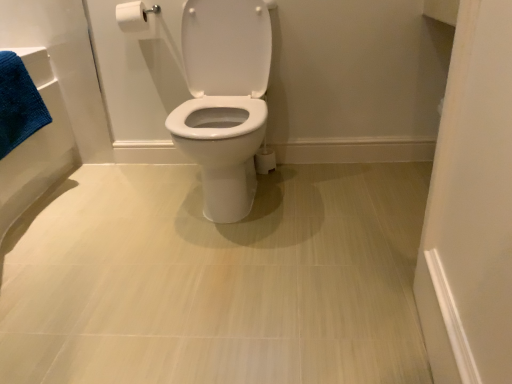
Find the location of a particular element. The width and height of the screenshot is (512, 384). white glossy toilet at center is located at coordinates (216, 279).

Locate an element on the screen. The image size is (512, 384). white matte toilet paper at upper left is located at coordinates (137, 19).

From a real-world perspective, is white glossy toilet at center positioned under blue cotton bath towel at left based on gravity?

Correct, in the physical world, white glossy toilet at center is lower than blue cotton bath towel at left.

Between white glossy toilet at center and blue cotton bath towel at left, which one has smaller width?

Thinner between the two is blue cotton bath towel at left.

Looking at this image, does white glossy toilet at center appear on the left side of blue cotton bath towel at left?

In fact, white glossy toilet at center is to the right of blue cotton bath towel at left.

Are white matte toilet paper at upper left and white glossy toilet at center located far from each other?

Yes, white matte toilet paper at upper left and white glossy toilet at center are located far from each other.

In terms of width, does white matte toilet paper at upper left look wider or thinner when compared to white glossy toilet at center?

Clearly, white matte toilet paper at upper left has less width compared to white glossy toilet at center.

Is white matte toilet paper at upper left not within white glossy toilet at center?

Indeed, white matte toilet paper at upper left is completely outside white glossy toilet at center.

At what (x,y) coordinates should I click in order to perform the action: click on plain that appears below the white matte toilet paper at upper left (from a real-world perspective). Please return your answer as a coordinate pair (x, y). This screenshot has height=384, width=512. Looking at the image, I should click on (216, 279).

From a real-world perspective, is white matte toilet paper at upper left below blue cotton bath towel at left?

Incorrect, from a real-world perspective, white matte toilet paper at upper left is higher than blue cotton bath towel at left.

Is white matte toilet paper at upper left oriented towards blue cotton bath towel at left?

No, white matte toilet paper at upper left is not facing towards blue cotton bath towel at left.

Considering the positions of objects white matte toilet paper at upper left and blue cotton bath towel at left in the image provided, who is more to the left, white matte toilet paper at upper left or blue cotton bath towel at left?

Positioned to the left is blue cotton bath towel at left.

From the picture: Is white glossy toilet at center directly adjacent to white matte toilet paper at upper left?

There is a gap between white glossy toilet at center and white matte toilet paper at upper left.

Identify the location of plain that appears in front of the white matte toilet paper at upper left. (216, 279).

Is point (407, 363) positioned in front of point (117, 8)?

Yes, it is.

Considering the sizes of objects blue cotton bath towel at left and white matte toilet paper at upper left in the image provided, who is bigger, blue cotton bath towel at left or white matte toilet paper at upper left?

With larger size is blue cotton bath towel at left.

Is blue cotton bath towel at left closer to the viewer compared to white matte toilet paper at upper left?

Yes, blue cotton bath towel at left is closer to the viewer.

From the image's perspective, which is above, blue cotton bath towel at left or white matte toilet paper at upper left?

white matte toilet paper at upper left is shown above in the image.

How different are the orientations of blue cotton bath towel at left and white matte toilet paper at upper left in degrees?

The angle between the facing direction of blue cotton bath towel at left and the facing direction of white matte toilet paper at upper left is 89.6 degrees.

Which of these two, blue cotton bath towel at left or white glossy toilet at center, is wider?

Wider between the two is white glossy toilet at center.

Looking at this image, between blue cotton bath towel at left and white glossy toilet at center, which one is positioned behind?

blue cotton bath towel at left is behind.

Could you tell me if blue cotton bath towel at left is turned towards white glossy toilet at center?

Yes.

Is blue cotton bath towel at left shorter than white glossy toilet at center?

Incorrect, the height of blue cotton bath towel at left does not fall short of that of white glossy toilet at center.

You are a GUI agent. You are given a task and a screenshot of the screen. Output one action in this format:
    pyautogui.click(x=<x>, y=<y>)
    Task: Click on the bath towel on the left of white glossy toilet at center
    The width and height of the screenshot is (512, 384).
    Given the screenshot: What is the action you would take?
    coord(18,104)

The image size is (512, 384). What are the coordinates of `toilet paper above the white glossy toilet at center (from the image's perspective)` in the screenshot? It's located at (137, 19).

Estimate the real-world distances between objects in this image. Which object is closer to blue cotton bath towel at left, white glossy toilet at center or white matte toilet paper at upper left?

Among the two, white matte toilet paper at upper left is located nearer to blue cotton bath towel at left.

Considering their positions, is blue cotton bath towel at left positioned further to white glossy toilet at center than white matte toilet paper at upper left?

The object further to white glossy toilet at center is white matte toilet paper at upper left.

Considering their positions, is white matte toilet paper at upper left positioned closer to blue cotton bath towel at left than white glossy toilet at center?

The object closer to blue cotton bath towel at left is white matte toilet paper at upper left.

Based on their spatial positions, is white glossy toilet at center or blue cotton bath towel at left further from white matte toilet paper at upper left?

white glossy toilet at center is positioned further to the anchor white matte toilet paper at upper left.

From the image, which object appears to be farther from white matte toilet paper at upper left, blue cotton bath towel at left or white glossy toilet at center?

white glossy toilet at center is further to white matte toilet paper at upper left.

When comparing their distances from white glossy toilet at center, does white matte toilet paper at upper left or blue cotton bath towel at left seem further?

white matte toilet paper at upper left.

Identify the location of bath towel between white matte toilet paper at upper left and white glossy toilet at center in the vertical direction. (18, 104).